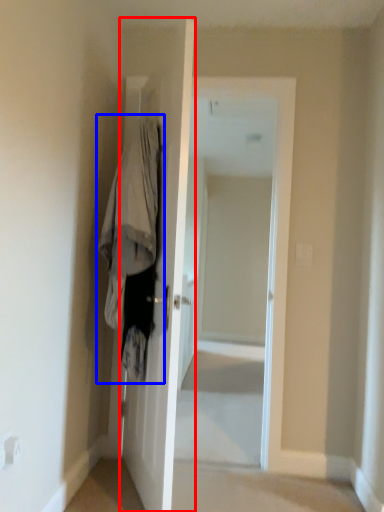
Question: Which point is closer to the camera, door (highlighted by a red box) or clothing (highlighted by a blue box)?

Choices:
 (A) door
 (B) clothing

Answer: (A)